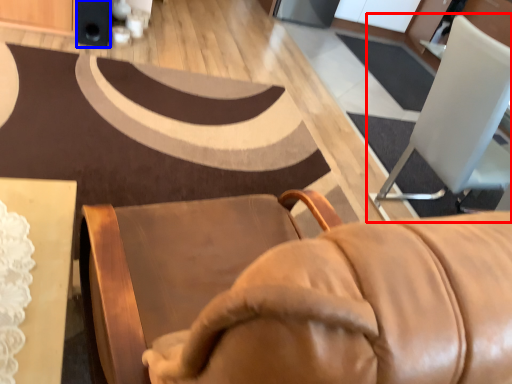
Question: Which point is closer to the camera, chair (highlighted by a red box) or speaker (highlighted by a blue box)?

Choices:
 (A) chair
 (B) speaker

Answer: (A)